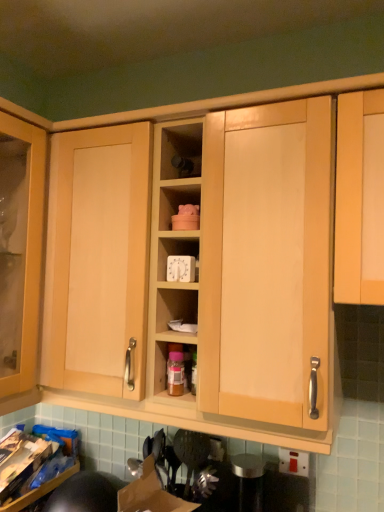
Question: In terms of height, does matte wood shelf at center look taller or shorter compared to white plastic timer at center?

Choices:
 (A) short
 (B) tall

Answer: (B)

Question: In the image, is matte wood shelf at center positioned in front of or behind white plastic timer at center?

Choices:
 (A) behind
 (B) front

Answer: (B)

Question: Which is farther from the translucent plastic bottle at center?

Choices:
 (A) matte wood shelf at center
 (B) white plastic timer at center

Answer: (A)

Question: Considering the real-world distances, which object is farthest from the translucent plastic bottle at center?

Choices:
 (A) matte wood shelf at center
 (B) white plastic timer at center

Answer: (A)